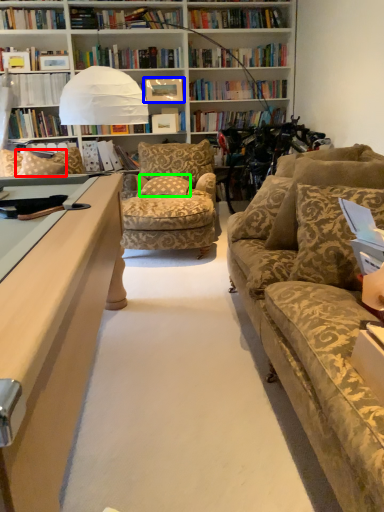
Question: Based on their relative distances, which object is nearer to pillow (highlighted by a red box)? Choose from paperback book (highlighted by a blue box) and pillow (highlighted by a green box).

Choices:
 (A) paperback book
 (B) pillow

Answer: (B)